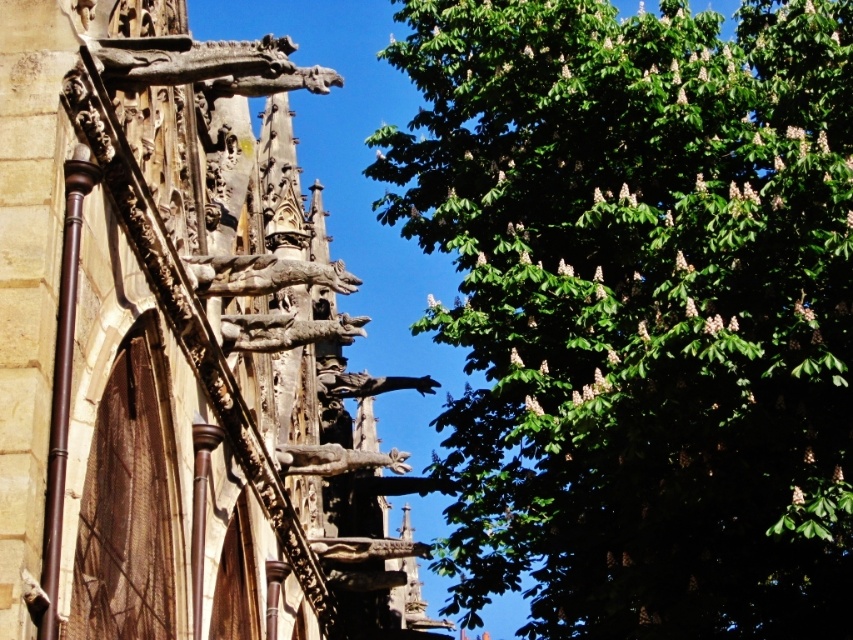
Question: Can you confirm if carved stone gargoyle at upper center is positioned to the right of bronze statue at center?

Choices:
 (A) yes
 (B) no

Answer: (B)

Question: Can you confirm if weathered stone gargoyle at upper left is positioned above carved stone gargoyle at upper center?

Choices:
 (A) no
 (B) yes

Answer: (A)

Question: Among these points, which one is nearest to the camera?

Choices:
 (A) (264, 284)
 (B) (276, 321)
 (C) (387, 458)

Answer: (A)

Question: Which object is the closest to the bronze statue at center?

Choices:
 (A) green leafy tree at upper right
 (B) wooden gargoyle at upper center
 (C) carved stone gargoyle at upper center

Answer: (B)

Question: Which point is closer to the camera?

Choices:
 (A) weathered stone gargoyle at upper left
 (B) wooden gargoyle at upper center
 (C) carved stone gargoyle at upper center
 (D) bronze statue at center

Answer: (A)

Question: Is weathered stone gargoyle at upper left smaller than brown stone gargoyle at upper left?

Choices:
 (A) no
 (B) yes

Answer: (A)